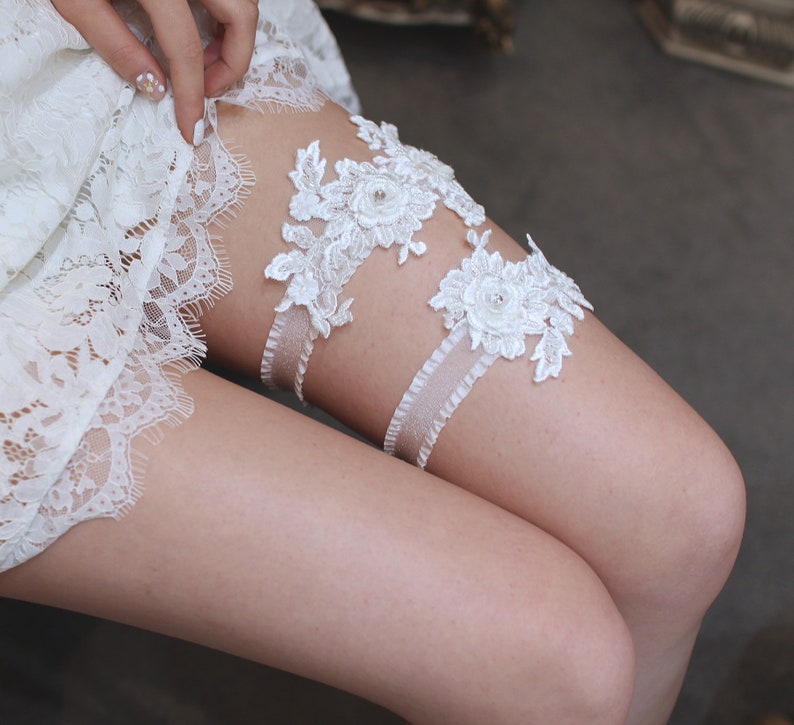
The width and height of the screenshot is (794, 725). What are the coordinates of `silk flower` in the screenshot? It's located at (496, 299), (376, 199).